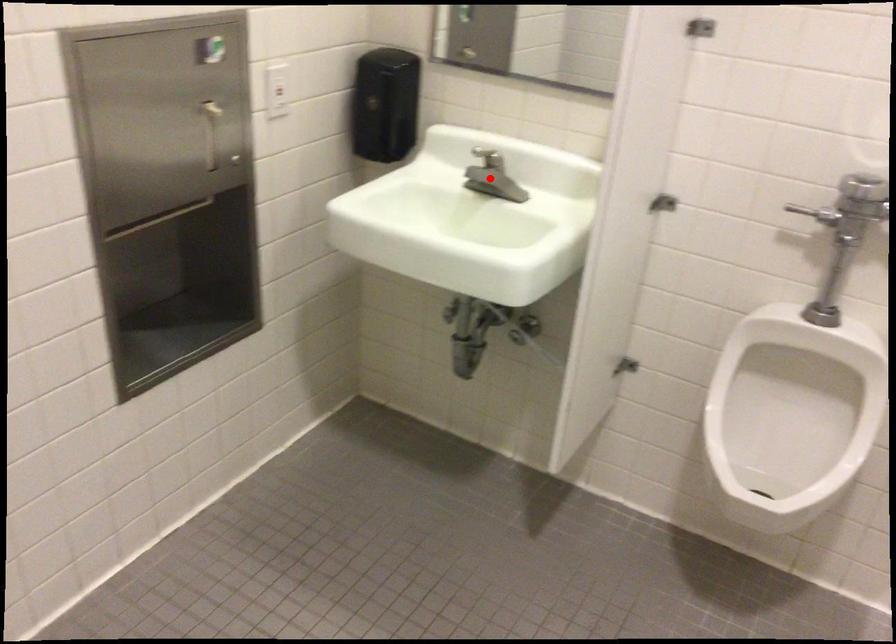
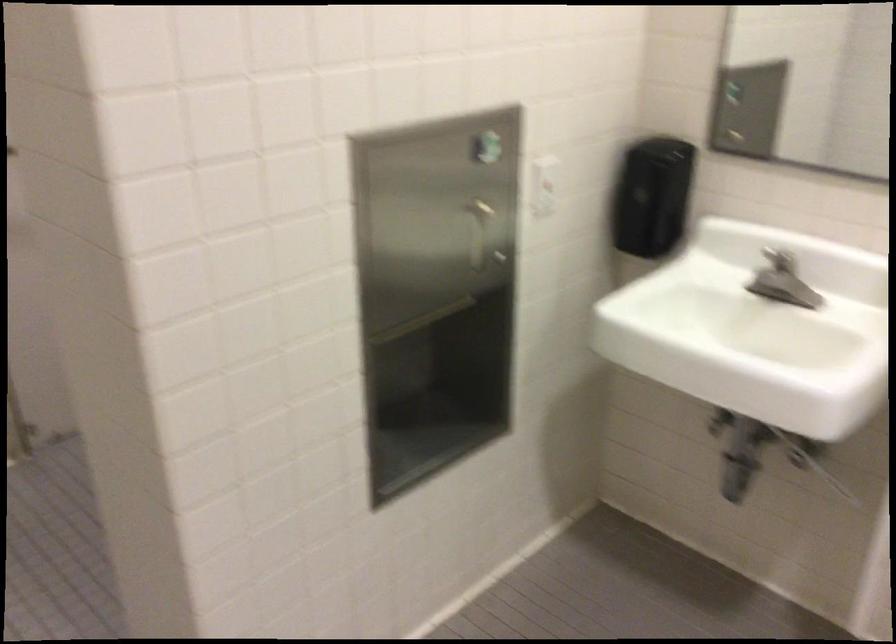
Locate, in the second image, the point that corresponds to the highlighted location in the first image.

(782, 281)